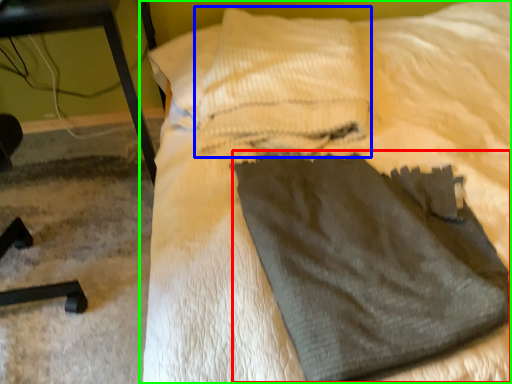
Question: Based on their relative distances, which object is farther from sweat pant (highlighted by a red box)? Choose from pillow (highlighted by a blue box) and bed (highlighted by a green box).

Choices:
 (A) pillow
 (B) bed

Answer: (A)